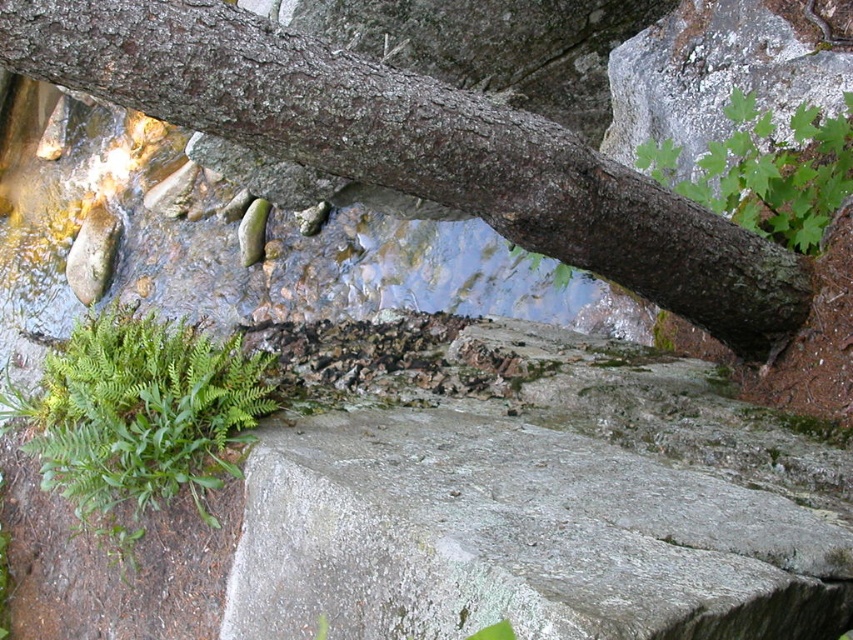
Who is more distant from viewer, (527, 164) or (660, 179)?

Positioned behind is point (660, 179).

Who is taller, smooth brown tree trunk at upper center or green leafy fern at upper right?

Standing taller between the two is smooth brown tree trunk at upper center.

Who is more forward, (579, 196) or (828, 122)?

Point (579, 196) is in front.

Where is `smooth brown tree trunk at upper center`? smooth brown tree trunk at upper center is located at coordinates (405, 145).

This screenshot has height=640, width=853. What do you see at coordinates (515, 538) in the screenshot?
I see `gray rough concrete at center` at bounding box center [515, 538].

Which is behind, point (337, 573) or point (804, 198)?

The point (804, 198) is behind.

This screenshot has width=853, height=640. I want to click on gray rough concrete at center, so click(515, 538).

Locate an element on the screen. Image resolution: width=853 pixels, height=640 pixels. gray rough concrete at center is located at coordinates (515, 538).

This screenshot has height=640, width=853. I want to click on gray rough concrete at center, so click(x=515, y=538).

Which is above, gray rough concrete at center or smooth brown tree trunk at upper center?

smooth brown tree trunk at upper center is above.

Does point (294, 548) come in front of point (207, 4)?

That is False.

The width and height of the screenshot is (853, 640). Find the location of `gray rough concrete at center`. gray rough concrete at center is located at coordinates pos(515,538).